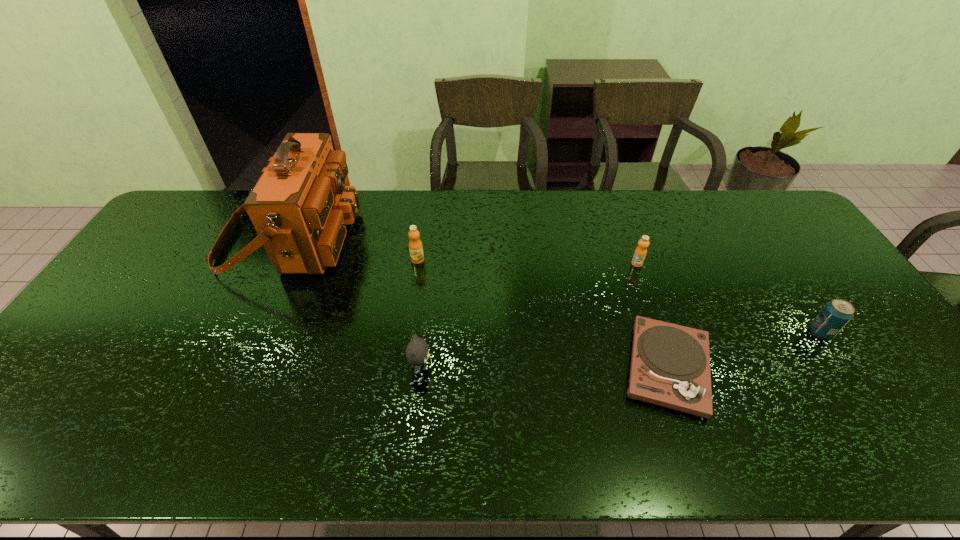
The width and height of the screenshot is (960, 540). In order to click on vacant space located on the front label of the shorter orange juice in this screenshot , I will do `click(651, 305)`.

Locate an element on the screen. The image size is (960, 540). free space located 0.330m on the back of the rightmost object is located at coordinates (761, 243).

Where is `vacant space situated 0.250m on the front-facing side of the kitten`? The width and height of the screenshot is (960, 540). vacant space situated 0.250m on the front-facing side of the kitten is located at coordinates (530, 367).

Where is `free spot located on the back of the phonograph_record`? The width and height of the screenshot is (960, 540). free spot located on the back of the phonograph_record is located at coordinates (644, 298).

You are a GUI agent. You are given a task and a screenshot of the screen. Output one action in this format:
    pyautogui.click(x=<x>, y=<y>)
    Task: Click on the object present at the far edge
    This screenshot has width=960, height=540.
    Given the screenshot: What is the action you would take?
    pyautogui.click(x=299, y=207)

Locate an element on the screen. The image size is (960, 540). object located at the right edge is located at coordinates (836, 314).

Image resolution: width=960 pixels, height=540 pixels. In the image, there is a desktop. Find the location of `vacant space at the far edge`. vacant space at the far edge is located at coordinates (547, 195).

This screenshot has height=540, width=960. Identify the location of free space at the near edge of the desktop. (153, 428).

Where is `vacant point at the right edge`? vacant point at the right edge is located at coordinates (849, 321).

This screenshot has width=960, height=540. In order to click on free space at the far left corner of the desktop in this screenshot , I will do `click(205, 207)`.